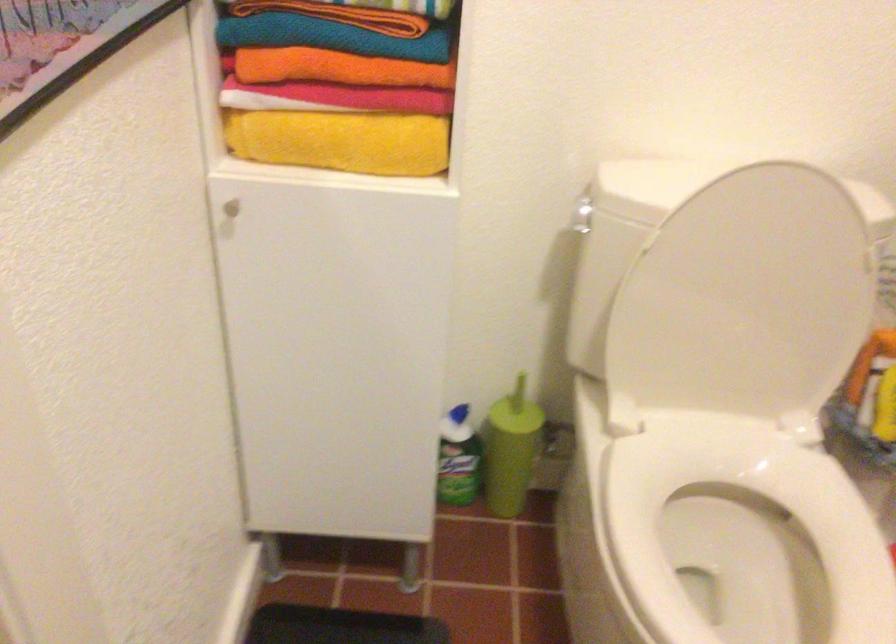
Find the location of a particular element. This screenshot has height=644, width=896. toilet flush handle is located at coordinates click(581, 214).